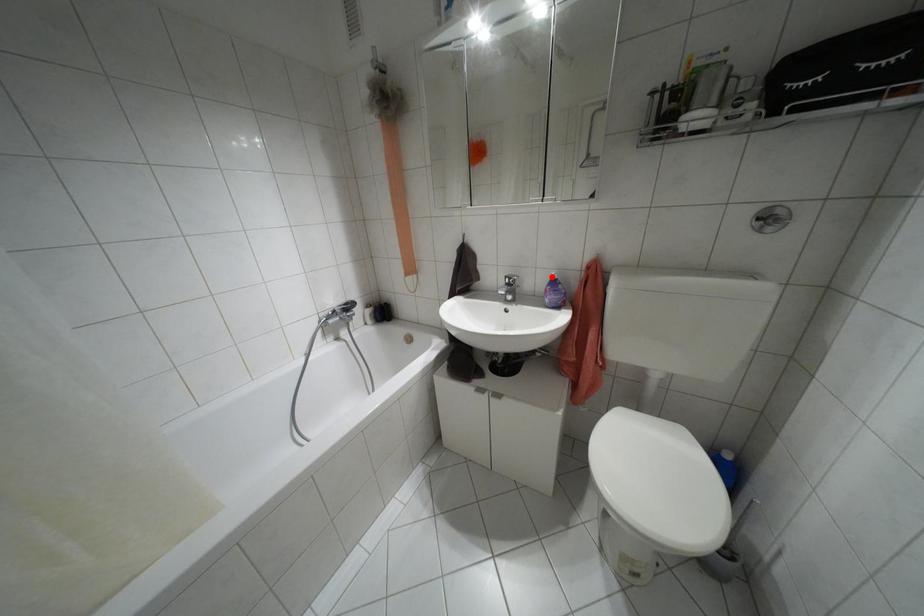
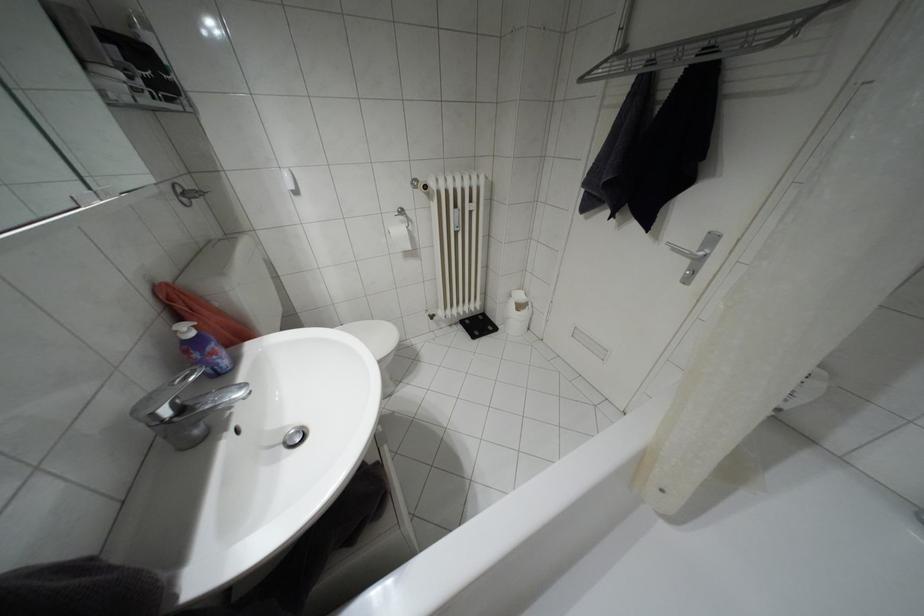
The point at the highlighted location is marked in the first image. Where is the corresponding point in the second image?

(190, 333)